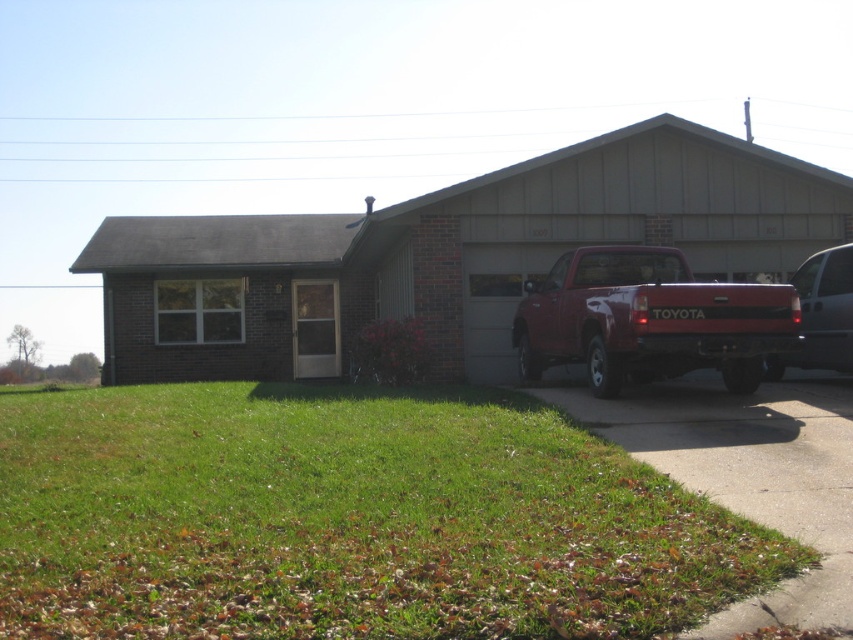
Question: Which point appears closest to the camera in this image?

Choices:
 (A) pyautogui.click(x=637, y=276)
 (B) pyautogui.click(x=782, y=362)
 (C) pyautogui.click(x=676, y=381)

Answer: (A)

Question: Is green grass at lower left to the right of metallic silver van at right from the viewer's perspective?

Choices:
 (A) no
 (B) yes

Answer: (A)

Question: Is green grass at lower left smaller than matte red truck at right?

Choices:
 (A) yes
 (B) no

Answer: (A)

Question: Which point is closer to the camera?

Choices:
 (A) metallic silver van at right
 (B) green grass at lower left

Answer: (B)

Question: Where is green grass at lower left located in relation to gray concrete driveway at lower right in the image?

Choices:
 (A) above
 (B) below

Answer: (B)

Question: Which point is closer to the camera?

Choices:
 (A) (221, 620)
 (B) (602, 397)
 (C) (846, 387)
 (D) (846, 342)

Answer: (A)